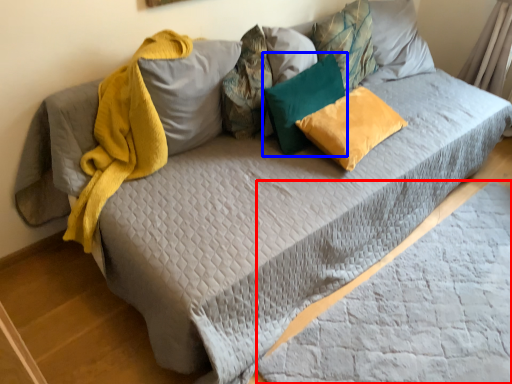
Question: Among these objects, which one is nearest to the camera, sheet (highlighted by a red box) or pillow (highlighted by a blue box)?

Choices:
 (A) sheet
 (B) pillow

Answer: (A)